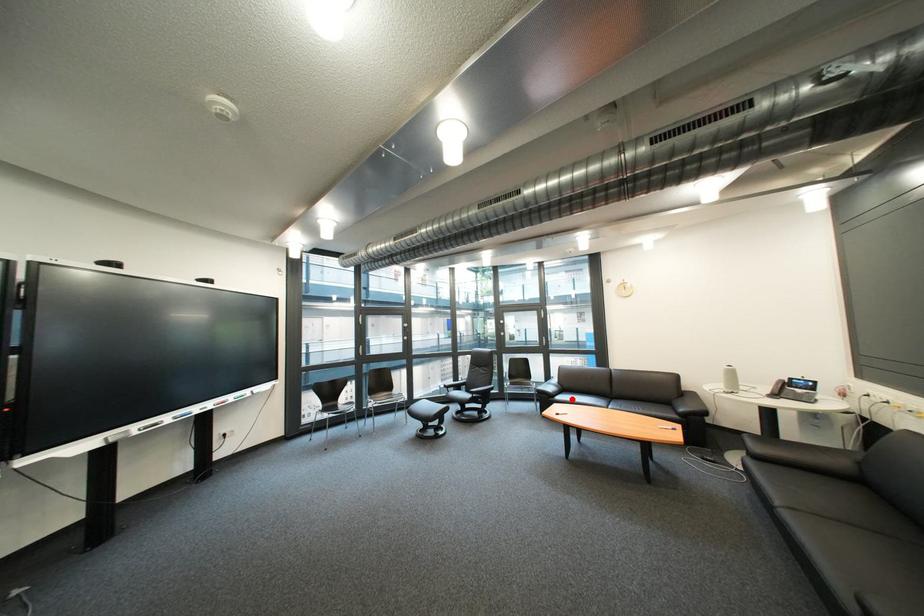
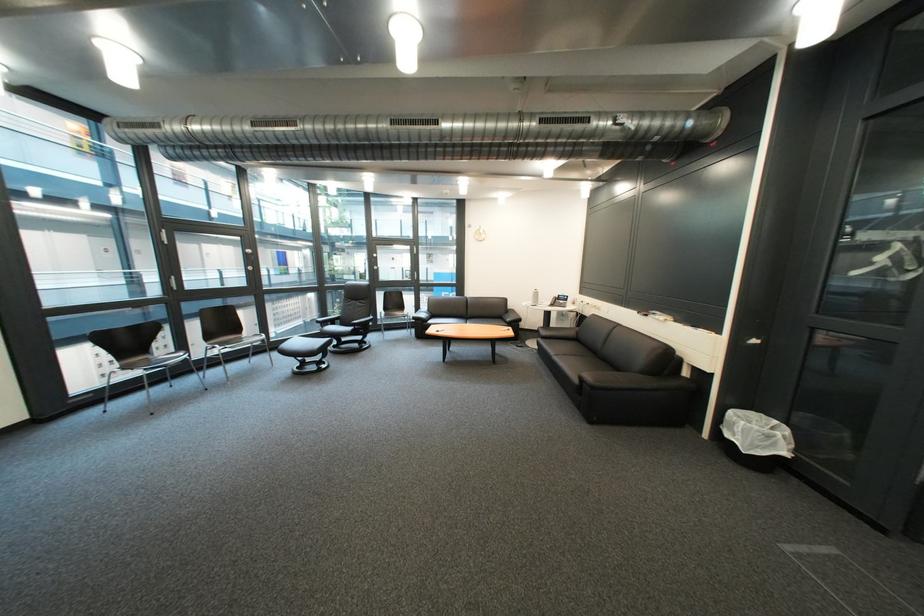
Find the pixel in the second image that matches the highlighted location in the first image.

(444, 323)